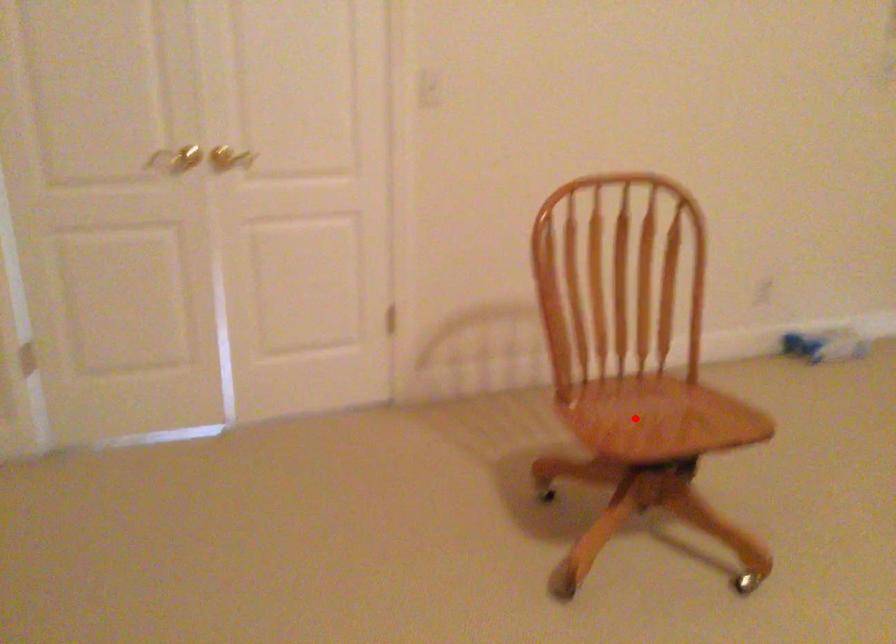
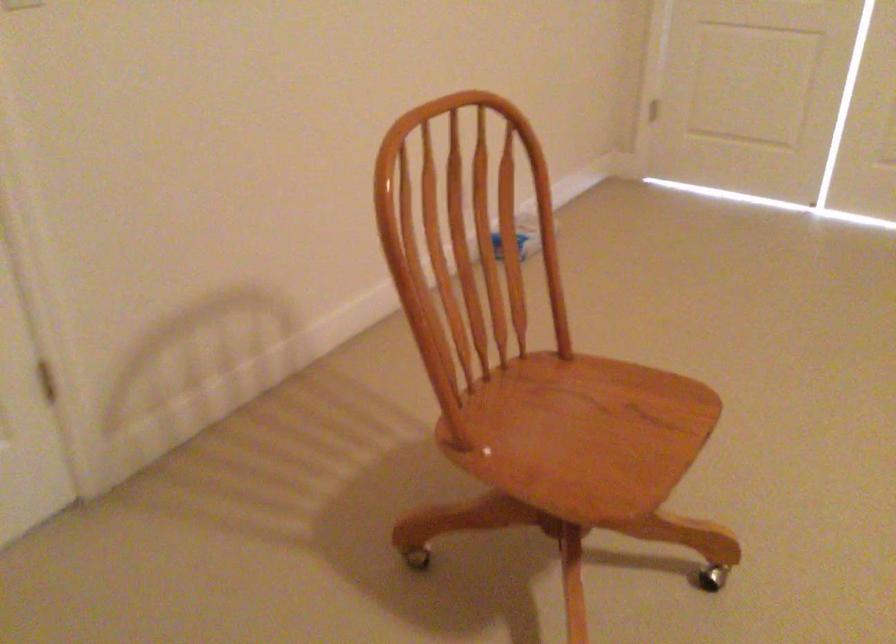
Locate, in the second image, the point that corresponds to the highlighted location in the first image.

(565, 436)